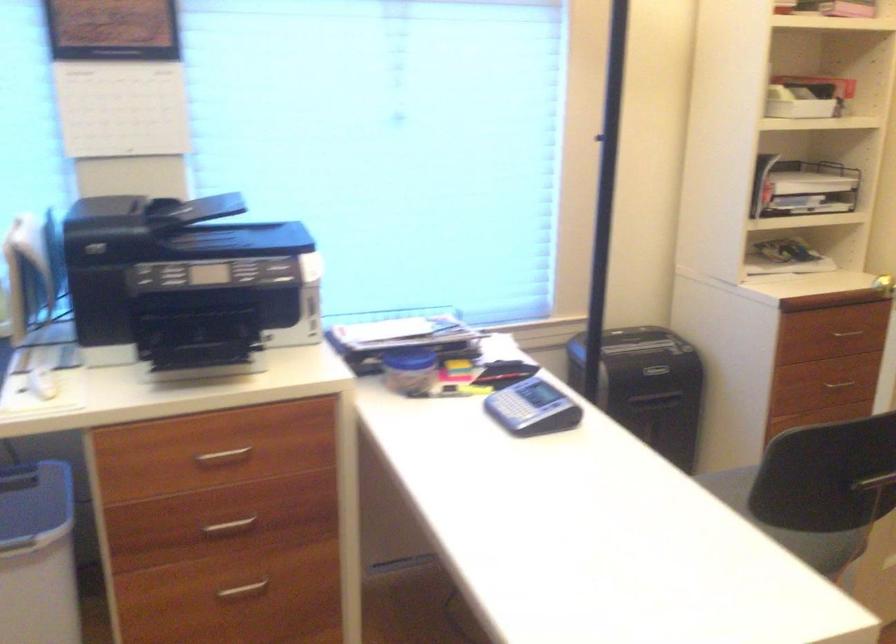
Identify the location of printer output tray. This screenshot has width=896, height=644. (197, 351).